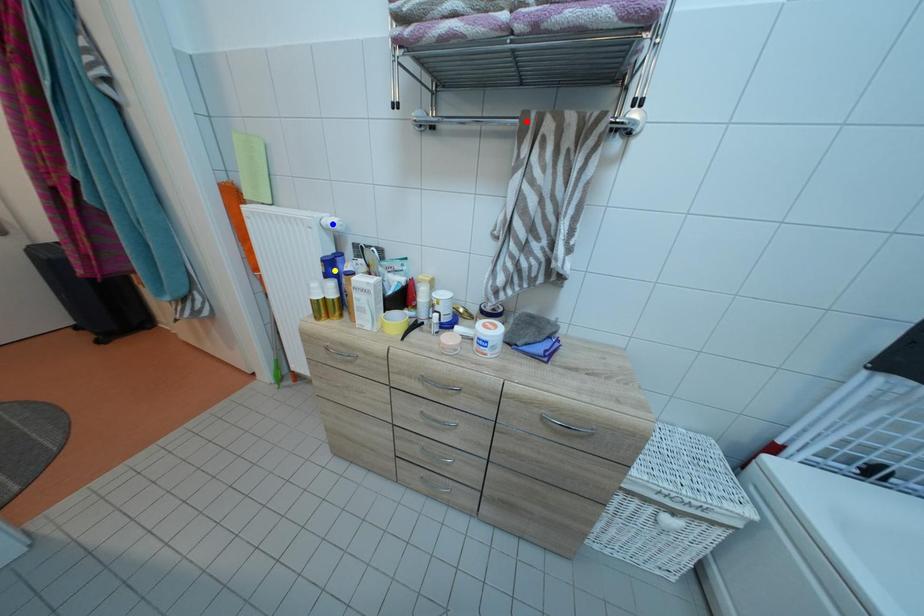
Order these from nearest to farthest:
- red point
- yellow point
- blue point

blue point
yellow point
red point